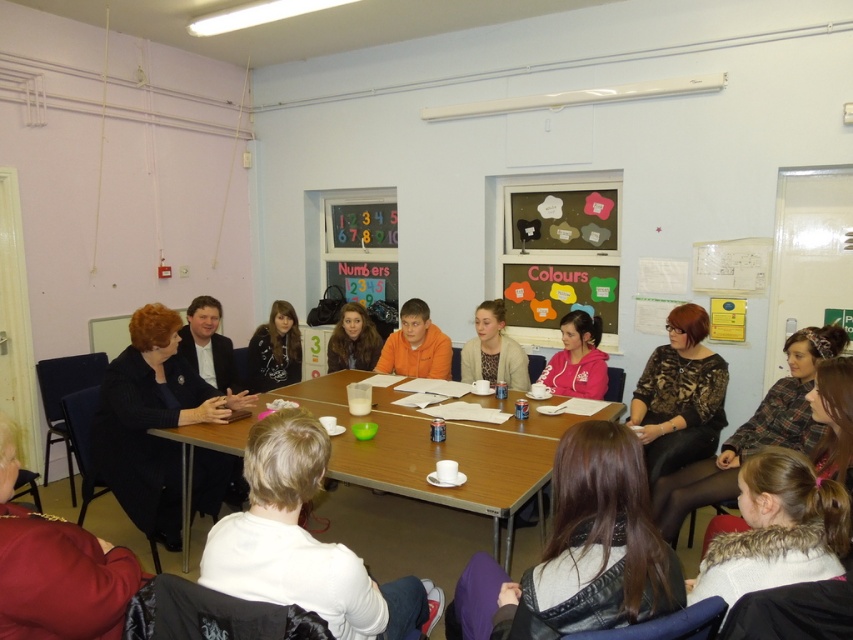
Question: Can you confirm if black textured blazer at left is positioned above cardboard bulletin board at center?

Choices:
 (A) no
 (B) yes

Answer: (A)

Question: Based on their relative distances, which object is farther from the white matte shirt at center?

Choices:
 (A) printed fabric blouse at center
 (B) smooth brown hair at lower center
 (C) cardboard bulletin board at center
 (D) pink fleece jacket at center

Answer: (C)

Question: Which object appears farthest from the camera in this image?

Choices:
 (A) printed fabric blouse at center
 (B) black textured blazer at left
 (C) white matte shirt at center

Answer: (B)

Question: Estimate the real-world distances between objects in this image. Which object is closer to the black textured blazer at left?

Choices:
 (A) light beige sweater at center
 (B) printed fabric blouse at center
 (C) brown fuzzy jacket at center

Answer: (C)

Question: Can you confirm if patterned fabric blouse at center is positioned above orange matte shirt at center?

Choices:
 (A) no
 (B) yes

Answer: (A)

Question: Does light beige sweater at center have a greater width compared to brown fuzzy jacket at center?

Choices:
 (A) yes
 (B) no

Answer: (A)